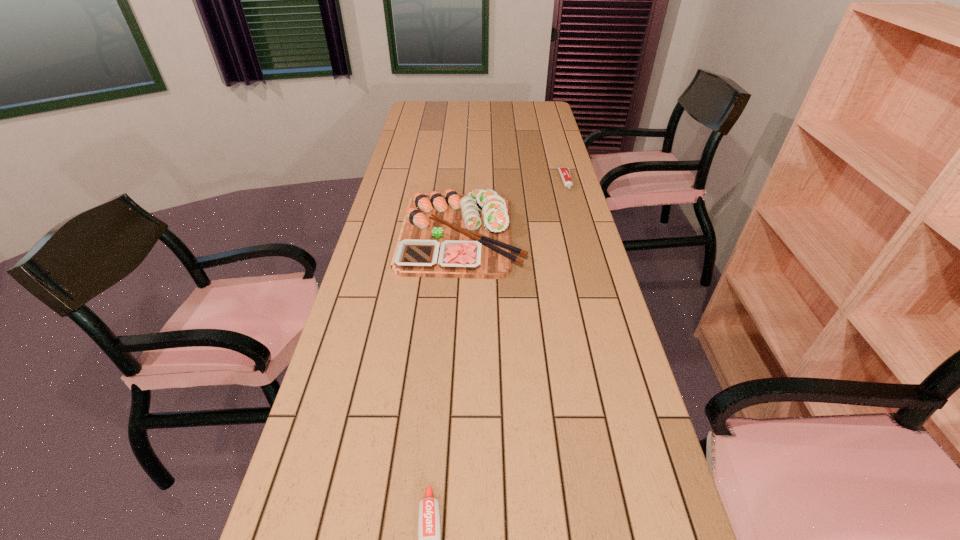
Where is `vacant space at the right edge of the desktop`? vacant space at the right edge of the desktop is located at coordinates (557, 188).

I want to click on empty space between the tallest object and the farther toothpaste, so click(514, 207).

The image size is (960, 540). In order to click on unoccupied position between the platter and the rightmost object in this screenshot , I will do `click(514, 207)`.

Where is `vacant space that's between the tallest object and the right toothpaste`? The image size is (960, 540). vacant space that's between the tallest object and the right toothpaste is located at coordinates (514, 207).

Find the location of a particular element. empty location between the farthest object and the tallest object is located at coordinates (514, 207).

Where is `empty space that is in between the right toothpaste and the tallest object`? The image size is (960, 540). empty space that is in between the right toothpaste and the tallest object is located at coordinates (514, 207).

Identify which object is the second nearest to the second farthest object. Please provide its 2D coordinates. Your answer should be formatted as a tuple, i.e. [(x, y)], where the tuple contains the x and y coordinates of a point satisfying the conditions above.

[(429, 533)]

Identify which object is the nearest to the nearest object. Please provide its 2D coordinates. Your answer should be formatted as a tuple, i.e. [(x, y)], where the tuple contains the x and y coordinates of a point satisfying the conditions above.

[(450, 235)]